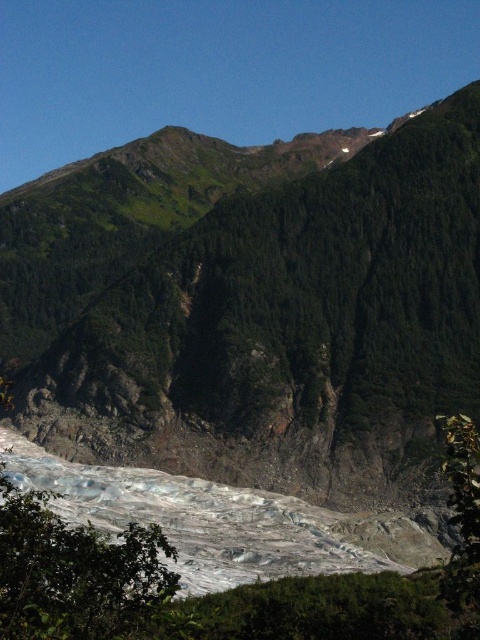
Is green rocky mountain at upper center taller than green leafy tree at lower left?

Indeed, green rocky mountain at upper center has a greater height compared to green leafy tree at lower left.

Locate an element on the screen. The image size is (480, 640). green rocky mountain at upper center is located at coordinates (253, 307).